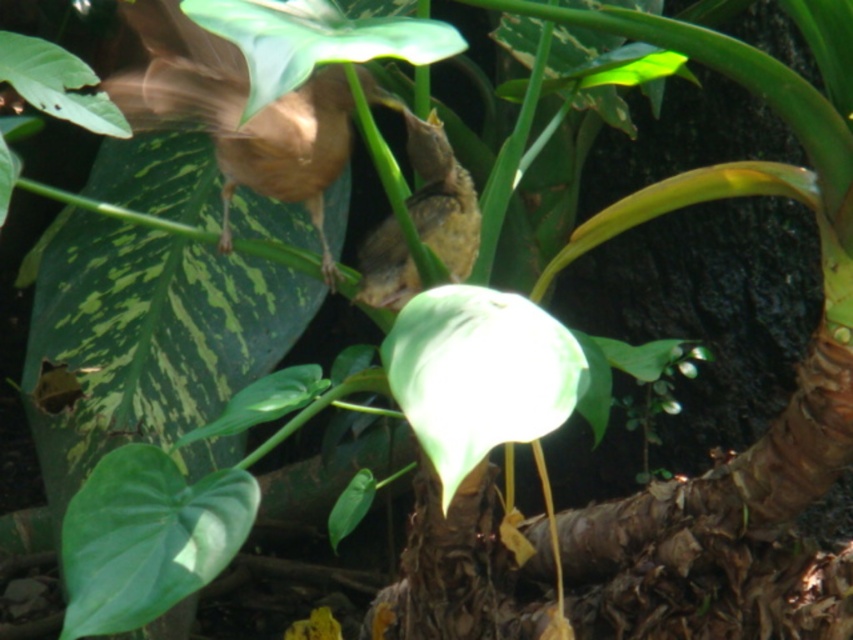
Question: Which object is the farthest from the green matte leaf at center?

Choices:
 (A) green matte leaf at upper left
 (B) green matte leaf at upper center
 (C) brown matte bird at upper left

Answer: (C)

Question: Does green matte leaf at center have a lesser width compared to brown matte bird at upper left?

Choices:
 (A) yes
 (B) no

Answer: (A)

Question: Where is brown matte bird at upper left located in relation to green matte leaf at upper center in the image?

Choices:
 (A) below
 (B) above

Answer: (B)

Question: Which point is farther from the camera taking this photo?

Choices:
 (A) (483, 438)
 (B) (405, 120)

Answer: (B)

Question: Is green matte leaf at lower left in front of green matte leaf at upper left?

Choices:
 (A) no
 (B) yes

Answer: (B)

Question: Which object appears closest to the camera in this image?

Choices:
 (A) brown matte bird at center
 (B) green matte leaf at upper left
 (C) green matte leaf at center

Answer: (C)